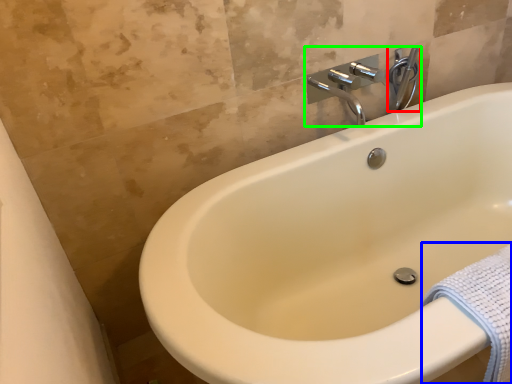
Question: Based on their relative distances, which object is farther from plumbing fixture (highlighted by a red box)? Choose from bath towel (highlighted by a blue box) and tap (highlighted by a green box).

Choices:
 (A) bath towel
 (B) tap

Answer: (A)